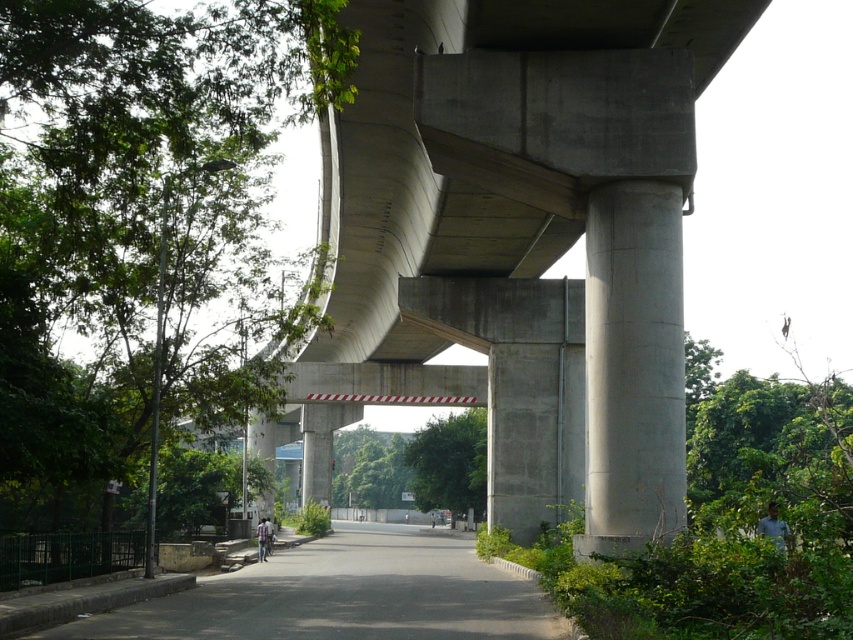
Question: Where is concrete at center located in relation to black asphalt road at center in the image?

Choices:
 (A) below
 (B) above

Answer: (B)

Question: Which point is closer to the camera?

Choices:
 (A) (666, 228)
 (B) (341, 541)

Answer: (A)

Question: Estimate the real-world distances between objects in this image. Which object is farther from the black asphalt road at center?

Choices:
 (A) concrete at center
 (B) gray concrete pillar at center

Answer: (B)

Question: Is concrete at center further to the viewer compared to black asphalt road at center?

Choices:
 (A) no
 (B) yes

Answer: (B)

Question: Which of the following is the closest to the observer?

Choices:
 (A) [289, 560]
 (B) [596, 516]

Answer: (B)

Question: Can you confirm if concrete at center is positioned below gray concrete pillar at center?

Choices:
 (A) no
 (B) yes

Answer: (A)